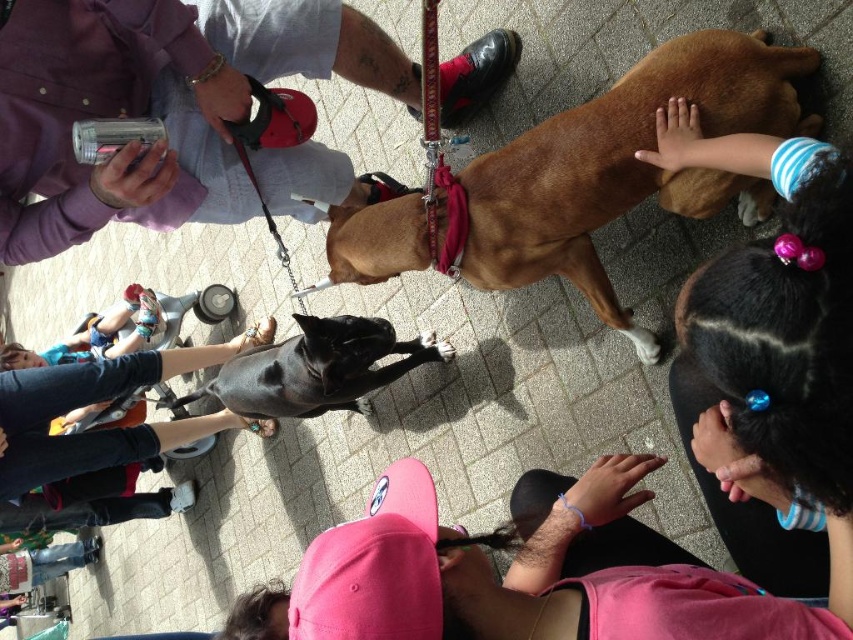
Can you confirm if dark brown hair at upper right is positioned below black smooth dog at center?

No, dark brown hair at upper right is not below black smooth dog at center.

Between point (709, 266) and point (285, 392), which one is positioned in front?

Point (709, 266) is in front.

What are the coordinates of `dark brown hair at upper right` in the screenshot? It's located at (776, 307).

How distant is black leather pants at lower left from black smooth dog at center?

Result: black leather pants at lower left and black smooth dog at center are 28.78 inches apart from each other.

Which is behind, point (9, 419) or point (453, 356)?

Point (9, 419)

Is point (207, 364) farther from viewer compared to point (341, 371)?

Yes, point (207, 364) is behind point (341, 371).

Where is `black leather pants at lower left`? The height and width of the screenshot is (640, 853). black leather pants at lower left is located at coordinates (102, 403).

Who is shorter, brown leather dog at center or pink fabric cap at lower center?

Standing shorter between the two is pink fabric cap at lower center.

Measure the distance between point (546, 193) and camera.

Point (546, 193) and camera are 5.40 feet apart from each other.

At what (x,y) coordinates should I click in order to perform the action: click on brown leather dog at center. Please return your answer as a coordinate pair (x, y). The image size is (853, 640). Looking at the image, I should click on (618, 168).